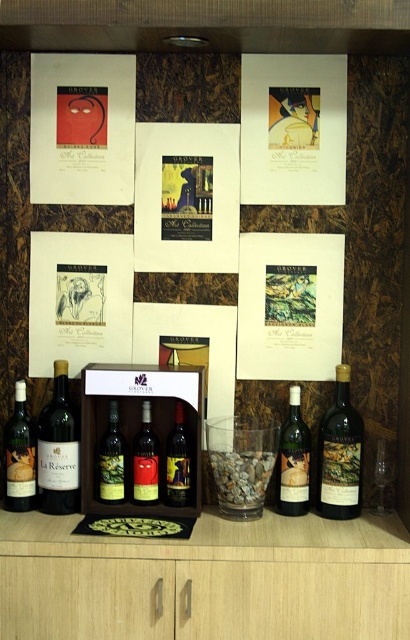
Question: Among these objects, which one is farthest from the camera?

Choices:
 (A) green glass bottle at center
 (B) matte black wine bottle at center

Answer: (A)

Question: Based on their relative distances, which object is farther from the matte glass wine bottle at right?

Choices:
 (A) matte black wine bottle at lower left
 (B) transparent glass wine glass at lower right
 (C) matte glass bottle at center
 (D) wooden wine rack at center

Answer: (A)

Question: Does wooden wine rack at center have a smaller size compared to matte black wine bottle at center?

Choices:
 (A) no
 (B) yes

Answer: (A)

Question: Observing the image, what is the correct spatial positioning of matte black wine bottle at lower left in reference to matte black wine bottle at center?

Choices:
 (A) right
 (B) left

Answer: (B)

Question: Estimate the real-world distances between objects in this image. Which object is closer to the green glass bottle at center?

Choices:
 (A) matte glass bottle at center
 (B) matte black wine bottle at center

Answer: (B)

Question: Does matte glass wine bottle at right lie behind matte glass bottle at center?

Choices:
 (A) no
 (B) yes

Answer: (A)